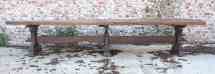
Image resolution: width=215 pixels, height=74 pixels. I want to click on bench legs, so click(x=32, y=30), click(x=108, y=33), click(x=179, y=35).